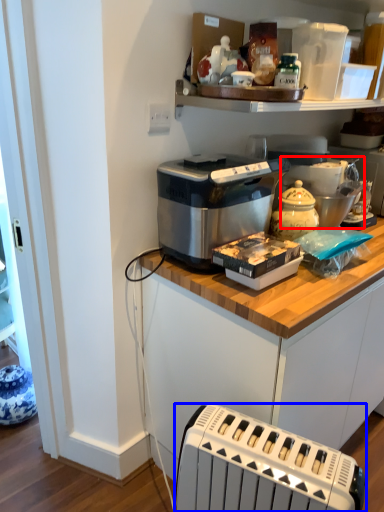
Question: Among these objects, which one is farthest to the camera, appliance (highlighted by a red box) or toaster (highlighted by a blue box)?

Choices:
 (A) appliance
 (B) toaster

Answer: (A)